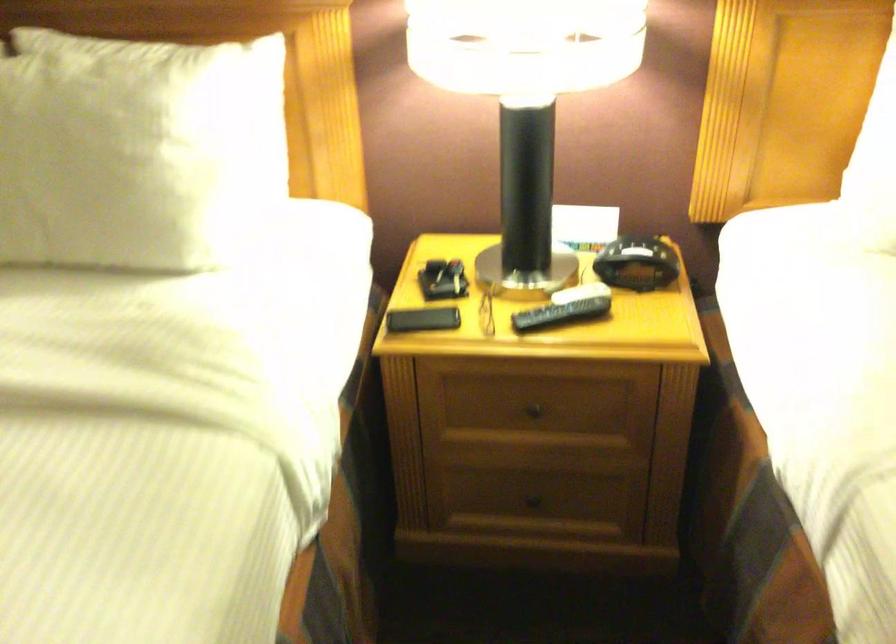
Where would you lift the black smartphone? Please return your answer as a coordinate pair (x, y).

(421, 319)